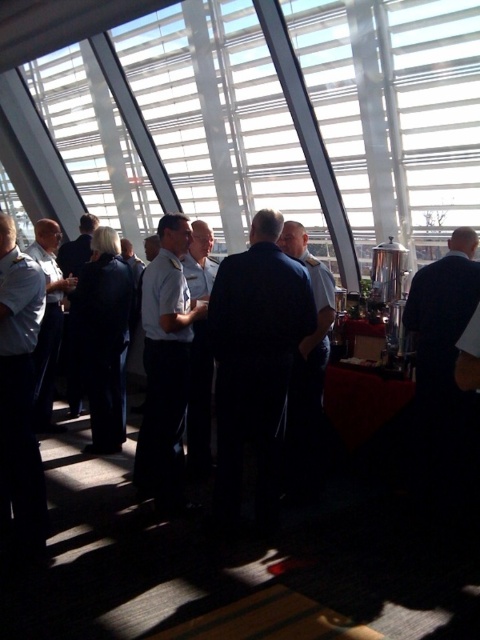
You are a photographer positioned at the entrance of the room. You need to capture a photo that includes both the dark blue suit at center and the light blue uniform at left while ensuring the subjects are not overlapping. Given the distance between them, can you position yourself in a way that both are fully visible without overlapping?

The distance between dark blue suit at center and light blue uniform at left is 3.61 feet. By positioning yourself at the entrance and angling the camera to include both subjects, you can ensure they are fully visible without overlapping as the separation allows sufficient space between them.

You are organizing a photo shoot and need to place two mannequins wearing the dark blue suit at center and the light blue uniform at left. The mannequin for the larger outfit requires a wider space. Which mannequin should be placed in the wider area?

The dark blue suit at center is larger in size than the light blue uniform at left, so the mannequin wearing the dark blue suit at center should be placed in the wider area.

You are a photographer trying to capture a clear image of the transparent glass window at center and the light blue uniform at center. Which object will appear smaller in the photo?

The transparent glass window at center will appear smaller in the photo because it occupies less space than the light blue uniform at center according to the description.